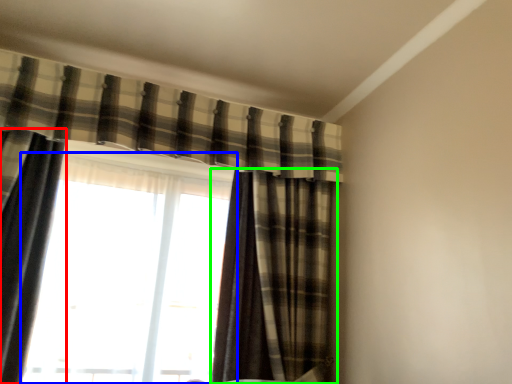
Question: Which object is positioned closest to curtain (highlighted by a red box)? Select from window (highlighted by a blue box) and curtain (highlighted by a green box).

Choices:
 (A) window
 (B) curtain

Answer: (A)